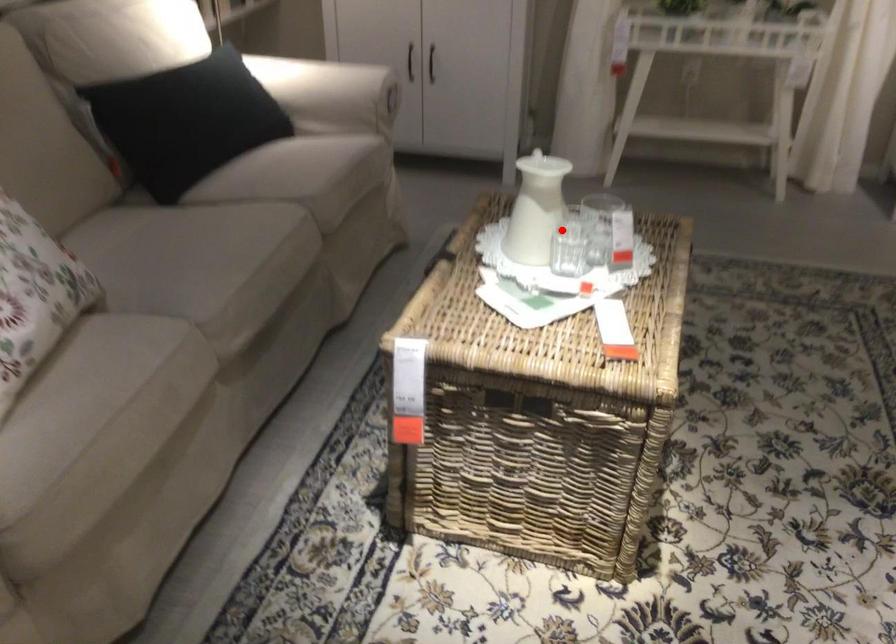
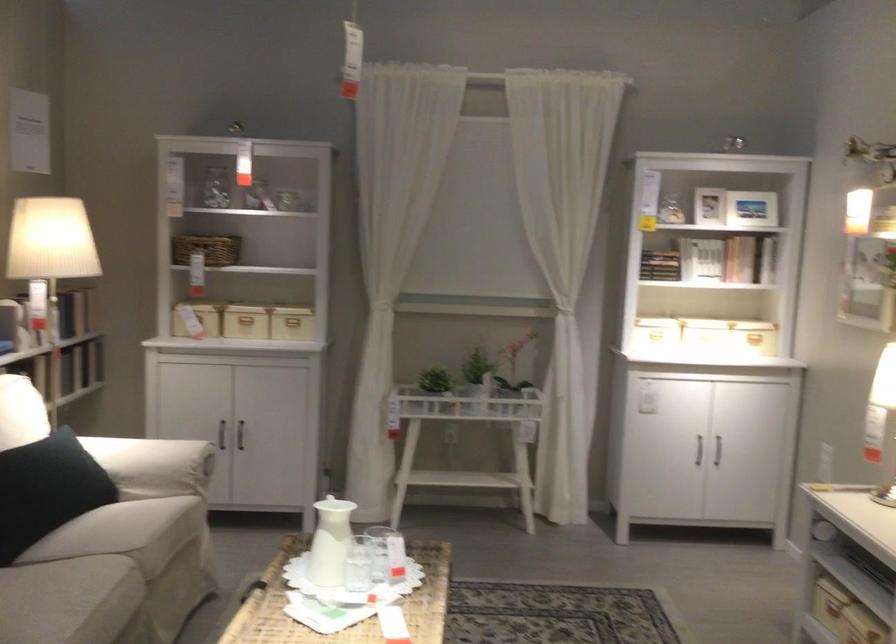
Question: I am providing you with two images of the same scene from different viewpoints. In image1, a red point is highlighted. Considering the same 3D point in image2, which of the following is correct?

Choices:
 (A) It is closer
 (B) It is farther

Answer: (B)